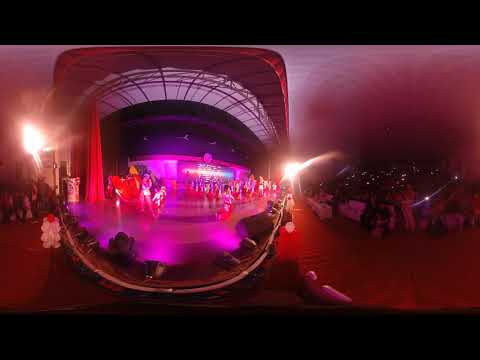
Where is `tv screen`? tv screen is located at coordinates (208, 171).